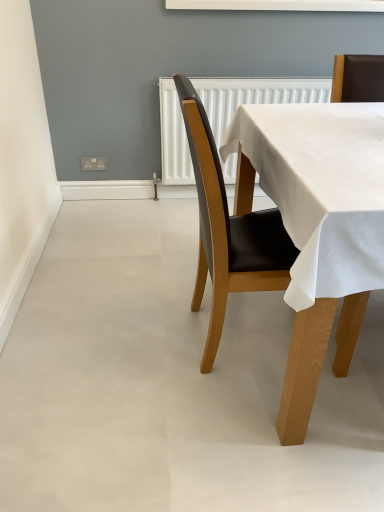
Measure the distance between brown leather chair at center and camera.

brown leather chair at center and camera are 39.13 inches apart.

At what (x,y) coordinates should I click in order to perform the action: click on brown leather chair at center. Please return your answer as a coordinate pair (x, y). Looking at the image, I should click on (228, 228).

What do you see at coordinates (228, 228) in the screenshot? I see `brown leather chair at center` at bounding box center [228, 228].

This screenshot has height=512, width=384. Identify the location of brown leather chair at center. pos(228,228).